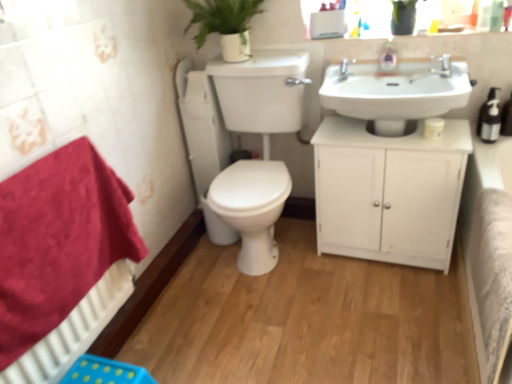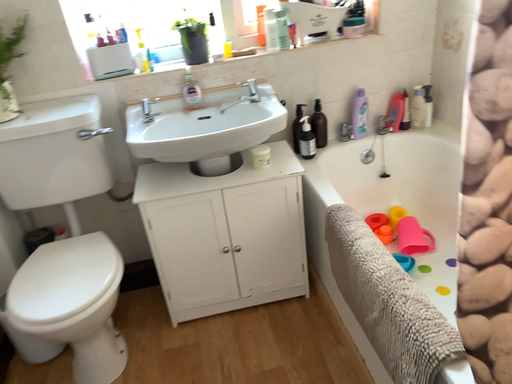
Question: Which way did the camera rotate in the video?

Choices:
 (A) rotated right
 (B) rotated left

Answer: (A)